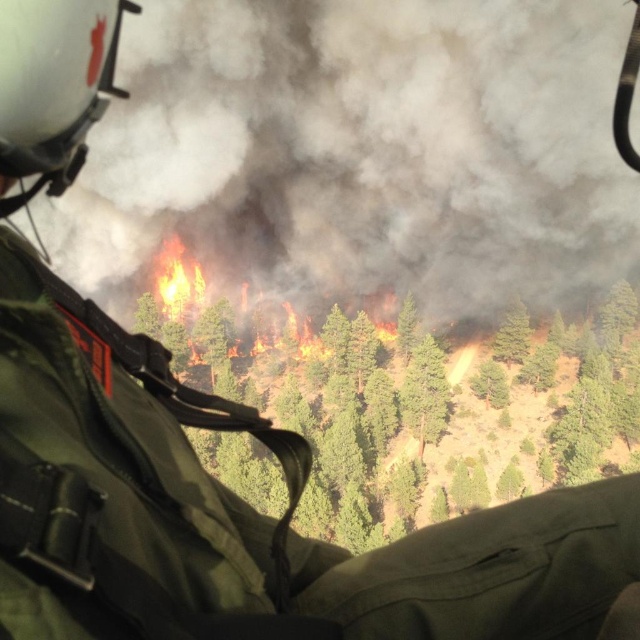
Is white matte helmet at upper left taller than flaming orange fire at center?

No.

Identify the location of white matte helmet at upper left. (52, 84).

Identify the location of white matte helmet at upper left. coord(52,84).